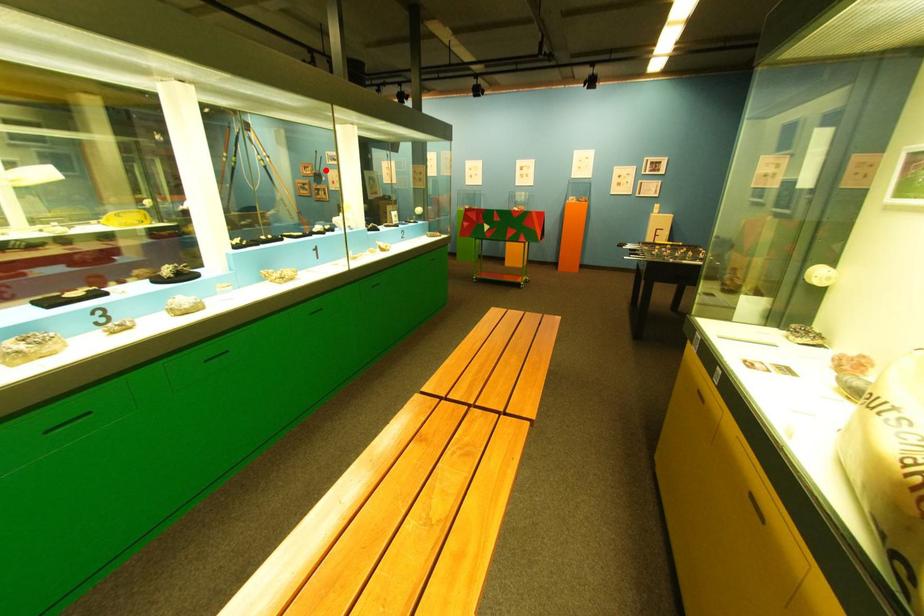
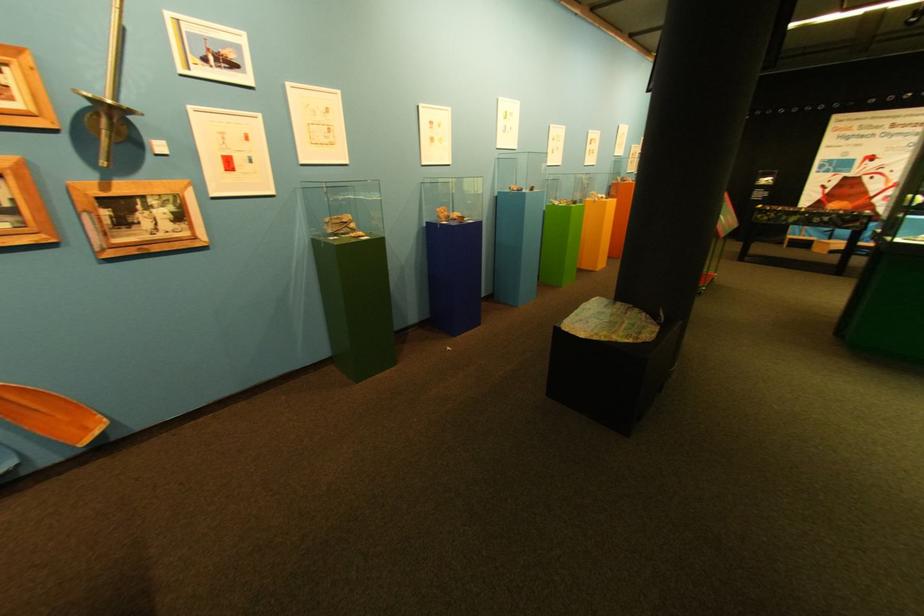
Question: I am providing you with two images of the same scene from different viewpoints. In image1, a red point is highlighted. Considering the same 3D point in image2, which of the following is correct?

Choices:
 (A) It is closer
 (B) It is farther

Answer: (B)